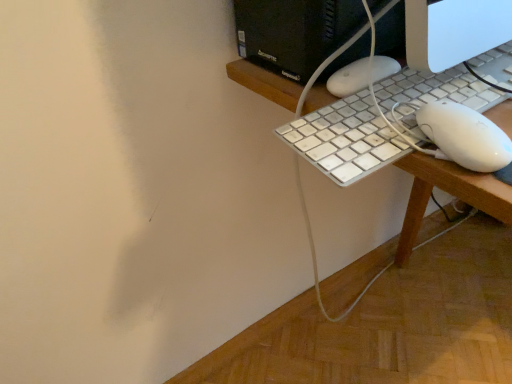
Question: Should I look upward or downward to see white plastic keyboard at right?

Choices:
 (A) up
 (B) down

Answer: (A)

Question: From the image's perspective, is white plastic keyboard at right on white plastic keyboard at center?

Choices:
 (A) no
 (B) yes

Answer: (B)

Question: Would you consider white plastic keyboard at right to be distant from white plastic keyboard at center?

Choices:
 (A) no
 (B) yes

Answer: (A)

Question: Is white plastic keyboard at right smaller than white plastic keyboard at center?

Choices:
 (A) yes
 (B) no

Answer: (A)

Question: From a real-world perspective, is white plastic keyboard at right below white plastic keyboard at center?

Choices:
 (A) yes
 (B) no

Answer: (B)

Question: From the image's perspective, would you say white plastic keyboard at right is shown under white plastic keyboard at center?

Choices:
 (A) no
 (B) yes

Answer: (A)

Question: Considering the relative positions of white plastic keyboard at right and white plastic keyboard at center in the image provided, is white plastic keyboard at right in front of white plastic keyboard at center?

Choices:
 (A) yes
 (B) no

Answer: (B)

Question: From a real-world perspective, is white plastic keyboard at center positioned over white plastic keyboard at right based on gravity?

Choices:
 (A) no
 (B) yes

Answer: (A)

Question: Considering the relative positions of white plastic keyboard at center and white plastic keyboard at right in the image provided, is white plastic keyboard at center to the left of white plastic keyboard at right from the viewer's perspective?

Choices:
 (A) no
 (B) yes

Answer: (A)

Question: Is the surface of white plastic keyboard at center in direct contact with white plastic keyboard at right?

Choices:
 (A) yes
 (B) no

Answer: (A)

Question: Does white plastic keyboard at center have a lesser height compared to white plastic keyboard at right?

Choices:
 (A) no
 (B) yes

Answer: (A)

Question: From the image's perspective, is white plastic keyboard at center above white plastic keyboard at right?

Choices:
 (A) yes
 (B) no

Answer: (B)

Question: From a real-world perspective, is white plastic keyboard at center beneath white plastic keyboard at right?

Choices:
 (A) yes
 (B) no

Answer: (A)

Question: Is point (507, 127) positioned closer to the camera than point (435, 77)?

Choices:
 (A) closer
 (B) farther

Answer: (A)